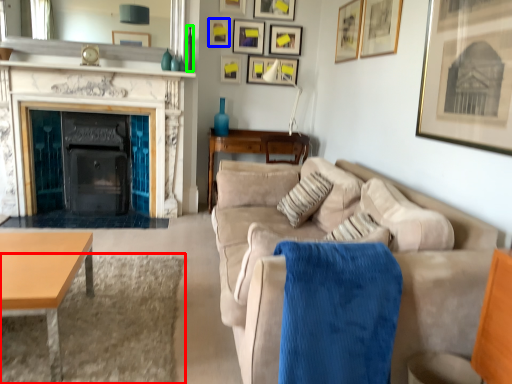
Question: Considering the real-world distances, which object is farthest from plain (highlighted by a red box)? picture frame (highlighted by a blue box) or vase (highlighted by a green box)?

Choices:
 (A) picture frame
 (B) vase

Answer: (A)